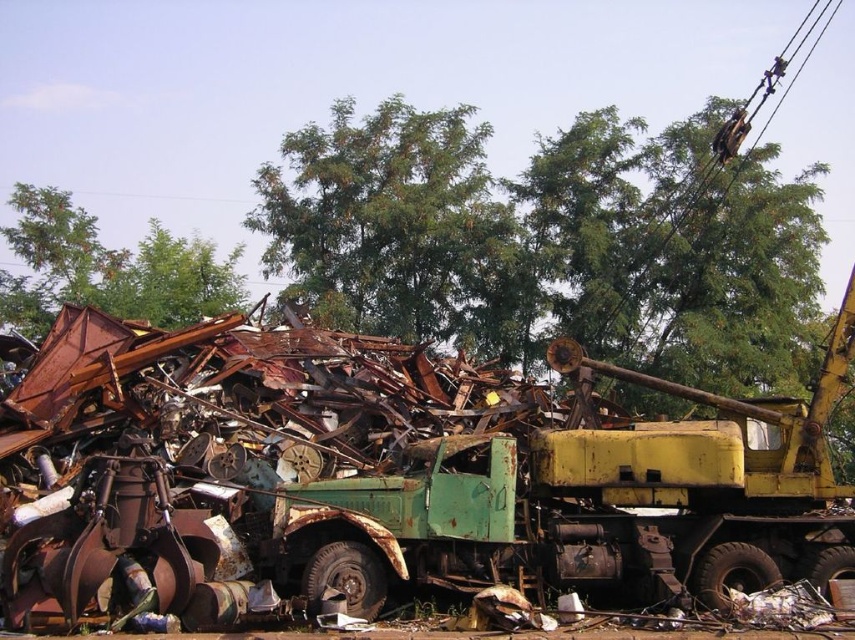
Looking at this image, who is lower down, rusty metal tow truck at center or green leafy tree at upper left?

Positioned lower is rusty metal tow truck at center.

Image resolution: width=855 pixels, height=640 pixels. What are the coordinates of `rusty metal tow truck at center` in the screenshot? It's located at coord(587,500).

The height and width of the screenshot is (640, 855). What are the coordinates of `rusty metal tow truck at center` in the screenshot? It's located at (587, 500).

Who is lower down, green leafy tree at upper center or green leafy tree at upper left?

green leafy tree at upper left

Can you confirm if green leafy tree at upper center is positioned to the left of green leafy tree at upper left?

In fact, green leafy tree at upper center is to the right of green leafy tree at upper left.

Is point (251, 212) positioned in front of point (130, 310)?

No, it is behind (130, 310).

Image resolution: width=855 pixels, height=640 pixels. In order to click on green leafy tree at upper center in this screenshot , I will do `click(397, 227)`.

From the picture: Between rusty metal tow truck at center and green leafy tree at upper center, which one has more height?

green leafy tree at upper center is taller.

Does rusty metal tow truck at center appear on the right side of green leafy tree at upper center?

Correct, you'll find rusty metal tow truck at center to the right of green leafy tree at upper center.

Who is more distant from viewer, (765, 502) or (329, 166)?

The point (329, 166) is more distant.

Where is `rusty metal tow truck at center`? Image resolution: width=855 pixels, height=640 pixels. rusty metal tow truck at center is located at coordinates tap(587, 500).